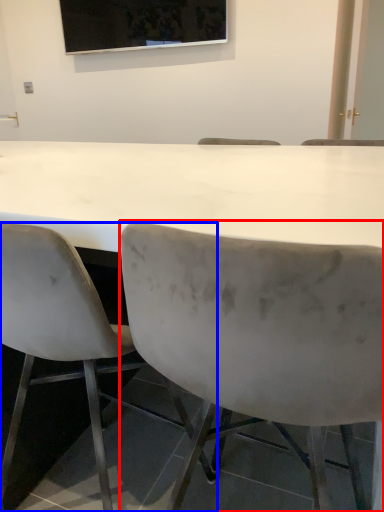
Question: Which of the following is the closest to the observer, chair (highlighted by a red box) or chair (highlighted by a blue box)?

Choices:
 (A) chair
 (B) chair

Answer: (A)